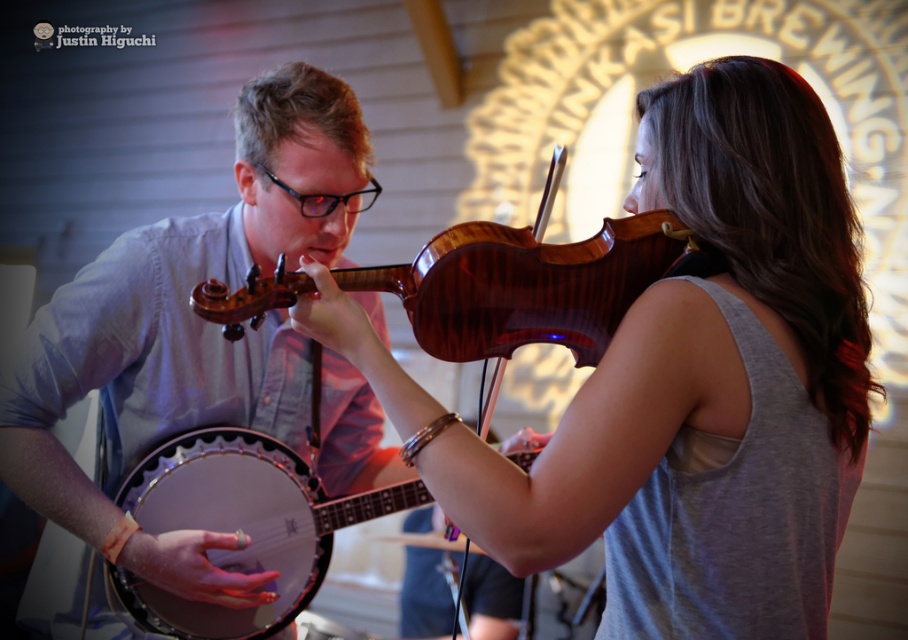
Which of these two, wooden violin at center or matte blue shirt at left, stands shorter?

Standing shorter between the two is wooden violin at center.

Identify the location of wooden violin at center. The width and height of the screenshot is (908, 640). (686, 381).

Identify the location of wooden violin at center. This screenshot has height=640, width=908. (686, 381).

Is point (840, 188) positioned in front of point (158, 467)?

Yes.

Which is above, wooden violin at center or matte brown banjo at center?

wooden violin at center is above.

Who is more distant from viewer, (837, 252) or (155, 516)?

The point (155, 516) is behind.

The image size is (908, 640). Find the location of `wooden violin at center`. wooden violin at center is located at coordinates (686, 381).

Consider the image. Who is more distant from viewer, (13,474) or (271,605)?

The point (271,605) is more distant.

Looking at this image, is matte blue shirt at left thinner than matte brown banjo at center?

No, matte blue shirt at left is not thinner than matte brown banjo at center.

Is point (216, 214) positioned before point (158, 508)?

No, it is behind (158, 508).

Find the location of a particular element. The width and height of the screenshot is (908, 640). matte blue shirt at left is located at coordinates pos(189,307).